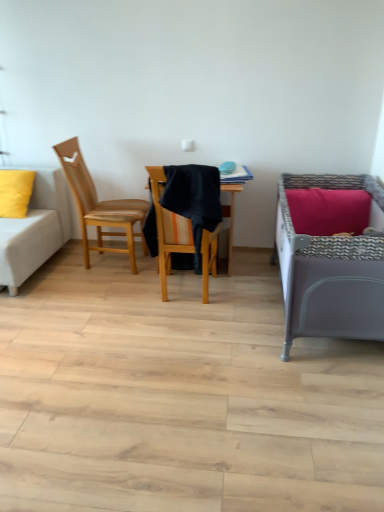
This screenshot has height=512, width=384. Describe the element at coordinates (100, 205) in the screenshot. I see `wooden chair at left, which is counted as the 1th chair, starting from the left` at that location.

The height and width of the screenshot is (512, 384). In order to click on matte yellow pillow at left in this screenshot , I will do `click(15, 192)`.

Does white fabric couch at left touch matte yellow pillow at left?

white fabric couch at left and matte yellow pillow at left are clearly separated.

Is white fabric couch at left bigger than matte yellow pillow at left?

Correct, white fabric couch at left is larger in size than matte yellow pillow at left.

You are a GUI agent. You are given a task and a screenshot of the screen. Output one action in this format:
    pyautogui.click(x=<x>, y=<y>)
    Task: Click on the pillow that appears on the right of white fabric couch at left
    This screenshot has width=384, height=512.
    Given the screenshot: What is the action you would take?
    pyautogui.click(x=15, y=192)

Consider the image. Which is correct: white fabric couch at left is inside matte yellow pillow at left, or outside of it?

white fabric couch at left exists outside the volume of matte yellow pillow at left.

Measure the distance between wooden chair at center, which is the second chair from left to right, and matte yellow pillow at left.

1.35 meters.

Which object is thinner, wooden chair at center, which is the second chair from left to right, or matte yellow pillow at left?

matte yellow pillow at left is thinner.

What's the angular difference between wooden chair at center, which is the second chair from left to right, and matte yellow pillow at left's facing directions?

wooden chair at center, which is the second chair from left to right, and matte yellow pillow at left are facing 175 degrees away from each other.

Would you consider wooden chair at center, which is the second chair from left to right, to be distant from matte yellow pillow at left?

Indeed, wooden chair at center, which is the second chair from left to right, is not near matte yellow pillow at left.

Does white fabric couch at left have a lesser width compared to gray fabric infant bed at right?

In fact, white fabric couch at left might be wider than gray fabric infant bed at right.

Consider the image. Can gray fabric infant bed at right be found inside white fabric couch at left?

Definitely not — gray fabric infant bed at right is not inside white fabric couch at left.

Is white fabric couch at left looking in the opposite direction of gray fabric infant bed at right?

That's not correct — white fabric couch at left is not looking away from gray fabric infant bed at right.

Which is less distant, (8, 277) or (340, 312)?

Clearly, point (8, 277) is more distant from the camera than point (340, 312).

Is gray fabric infant bed at right bigger than matte yellow pillow at left?

Correct, gray fabric infant bed at right is larger in size than matte yellow pillow at left.

Considering the positions of points (340, 244) and (11, 204), is point (340, 244) closer to camera compared to point (11, 204)?

Yes.

Which object is further away from the camera taking this photo, wooden chair at left, the second chair from the right, or matte yellow pillow at left?

matte yellow pillow at left is more distant.

Which object is positioned more to the right, wooden chair at left, which is counted as the 1th chair, starting from the left, or matte yellow pillow at left?

Positioned to the right is wooden chair at left, which is counted as the 1th chair, starting from the left.

Is point (128, 219) in front of point (3, 208)?

Yes, point (128, 219) is in front of point (3, 208).

From a real-world perspective, is wooden chair at left, the second chair from the right, on top of matte yellow pillow at left?

No, from a real-world perspective, wooden chair at left, the second chair from the right, is not on top of matte yellow pillow at left.

Measure the distance between matte yellow pillow at left and wooden chair at left, which is counted as the 1th chair, starting from the left.

matte yellow pillow at left is 22.61 inches away from wooden chair at left, which is counted as the 1th chair, starting from the left.

Based on the photo, is matte yellow pillow at left wider than wooden chair at left, which is counted as the 1th chair, starting from the left?

In fact, matte yellow pillow at left might be narrower than wooden chair at left, which is counted as the 1th chair, starting from the left.

Considering the relative sizes of matte yellow pillow at left and wooden chair at left, which is counted as the 1th chair, starting from the left, in the image provided, is matte yellow pillow at left shorter than wooden chair at left, which is counted as the 1th chair, starting from the left,?

Correct, matte yellow pillow at left is not as tall as wooden chair at left, which is counted as the 1th chair, starting from the left.

Considering the sizes of objects white fabric couch at left and wooden chair at left, the second chair from the right, in the image provided, who is bigger, white fabric couch at left or wooden chair at left, the second chair from the right,?

white fabric couch at left.

From the image's perspective, is white fabric couch at left positioned above or below wooden chair at left, which is counted as the 1th chair, starting from the left?

Clearly, from the image's perspective, white fabric couch at left is below wooden chair at left, which is counted as the 1th chair, starting from the left.

From a real-world perspective, is white fabric couch at left located beneath wooden chair at left, which is counted as the 1th chair, starting from the left?

Correct, in the physical world, white fabric couch at left is lower than wooden chair at left, which is counted as the 1th chair, starting from the left.

Consider the image. In terms of width, does white fabric couch at left look wider or thinner when compared to wooden chair at left, which is counted as the 1th chair, starting from the left?

white fabric couch at left is wider than wooden chair at left, which is counted as the 1th chair, starting from the left.

At what (x,y) coordinates should I click in order to perform the action: click on studio couch located in front of the matte yellow pillow at left. Please return your answer as a coordinate pair (x, y). This screenshot has width=384, height=512. Looking at the image, I should click on (35, 230).

The width and height of the screenshot is (384, 512). In order to click on pillow above the wooden chair at center, which is the second chair from left to right (from the image's perspective) in this screenshot , I will do `click(15, 192)`.

Which object lies further to the anchor point gray fabric infant bed at right, wooden chair at center, the first chair positioned from the right, or white fabric couch at left?

The object further to gray fabric infant bed at right is white fabric couch at left.

Estimate the real-world distances between objects in this image. Which object is closer to gray fabric infant bed at right, matte yellow pillow at left or wooden chair at center, the first chair positioned from the right?

Among the two, wooden chair at center, the first chair positioned from the right, is located nearer to gray fabric infant bed at right.

Based on their spatial positions, is gray fabric infant bed at right or white fabric couch at left closer to wooden chair at left, which is counted as the 1th chair, starting from the left?

white fabric couch at left is closer to wooden chair at left, which is counted as the 1th chair, starting from the left.

When comparing their distances from gray fabric infant bed at right, does wooden chair at left, the second chair from the right, or matte yellow pillow at left seem further?

Among the two, matte yellow pillow at left is located further to gray fabric infant bed at right.

From the image, which object appears to be nearer to gray fabric infant bed at right, white fabric couch at left or matte yellow pillow at left?

The object closer to gray fabric infant bed at right is white fabric couch at left.

Looking at the image, which one is located further to wooden chair at center, the first chair positioned from the right, wooden chair at left, the second chair from the right, or gray fabric infant bed at right?

wooden chair at left, the second chair from the right, lies further to wooden chair at center, the first chair positioned from the right, than the other object.

Based on their spatial positions, is white fabric couch at left or wooden chair at center, the first chair positioned from the right, closer to matte yellow pillow at left?

The object closer to matte yellow pillow at left is white fabric couch at left.

Based on their spatial positions, is wooden chair at center, which is the second chair from left to right, or wooden chair at left, which is counted as the 1th chair, starting from the left, closer to gray fabric infant bed at right?

Among the two, wooden chair at center, which is the second chair from left to right, is located nearer to gray fabric infant bed at right.

Identify the location of chair between matte yellow pillow at left and wooden chair at center, which is the second chair from left to right. This screenshot has height=512, width=384. (100, 205).

Where is `pillow located between white fabric couch at left and wooden chair at center, which is the second chair from left to right, in the left-right direction`? pillow located between white fabric couch at left and wooden chair at center, which is the second chair from left to right, in the left-right direction is located at coordinates (15, 192).

Locate an element on the screen. The width and height of the screenshot is (384, 512). chair located between wooden chair at left, which is counted as the 1th chair, starting from the left, and gray fabric infant bed at right in the left-right direction is located at coordinates (168, 229).

Locate an element on the screen. pillow between white fabric couch at left and wooden chair at left, which is counted as the 1th chair, starting from the left, in the horizontal direction is located at coordinates (15, 192).